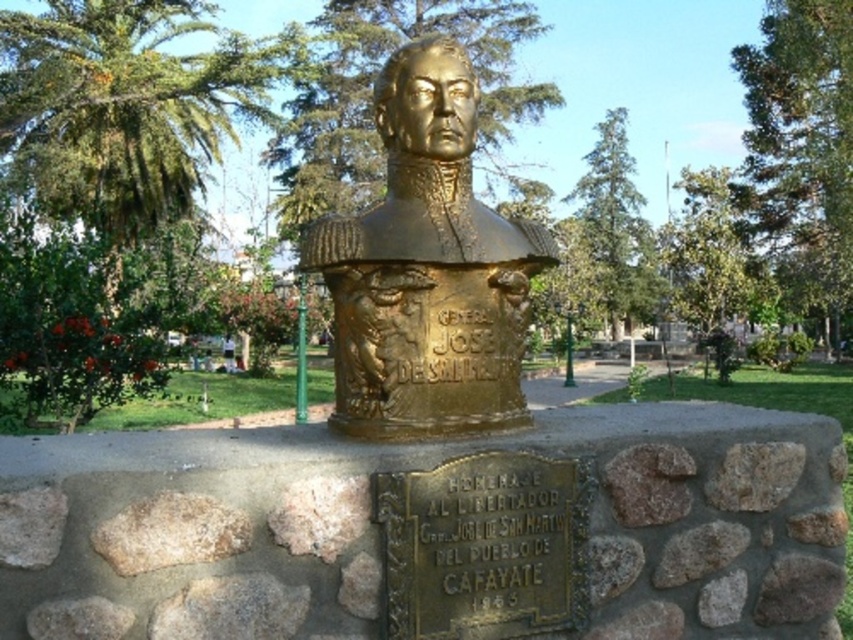
You are a visitor at a historical park and see the gold polished bust at center and the green leafy palm tree at upper center. Which object is located higher in the image?

The green leafy palm tree at upper center is higher in the image since it is positioned above the gold polished bust at center.

You are a tourist standing in front of the monument. You notice the gold polished bust at center and the green leafy palm tree at upper center. Which object is taller?

The gold polished bust at center has a lesser height compared to the green leafy palm tree at upper center, so the green leafy palm tree at upper center is taller.